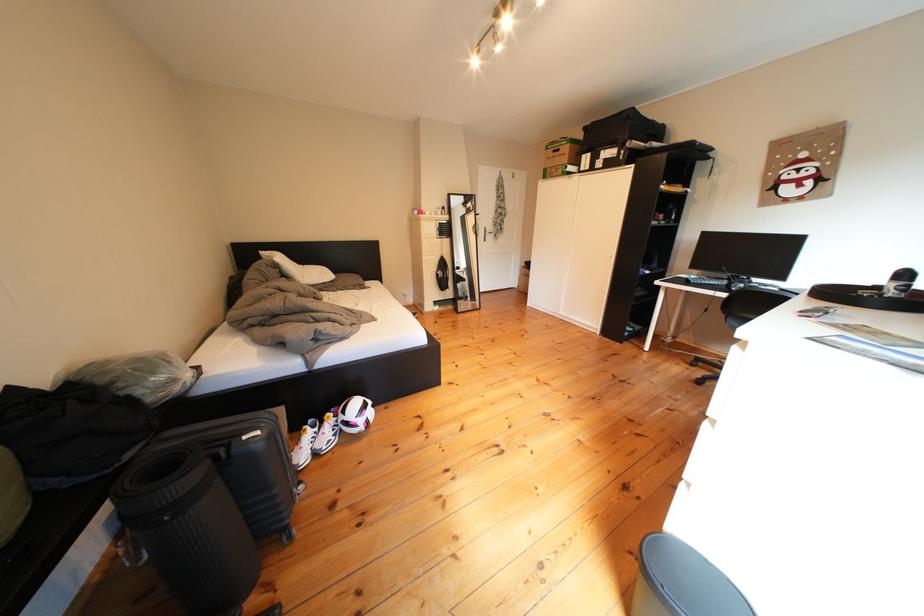
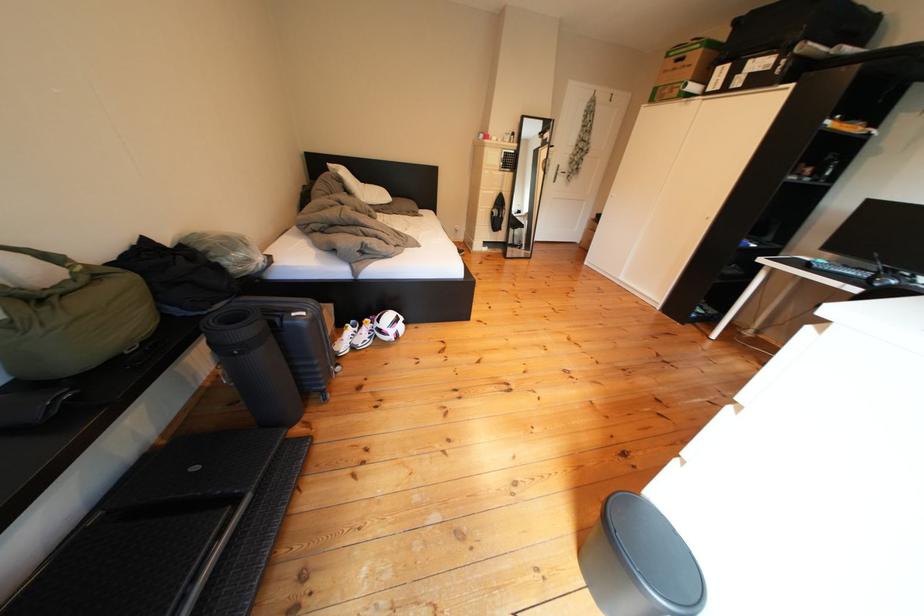
Where in the second image is the point corresponding to the point at 558,175 from the first image?

(670, 95)